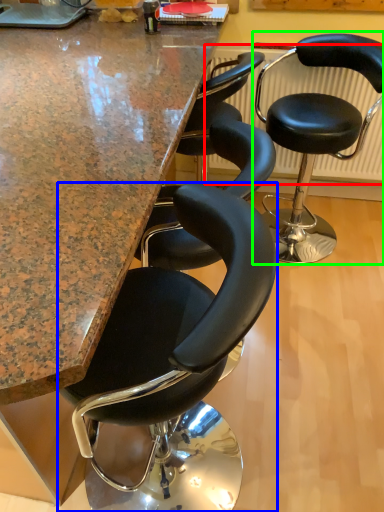
Question: Based on their relative distances, which object is nearer to radiator (highlighted by a red box)? Choose from chair (highlighted by a blue box) and chair (highlighted by a green box).

Choices:
 (A) chair
 (B) chair

Answer: (B)